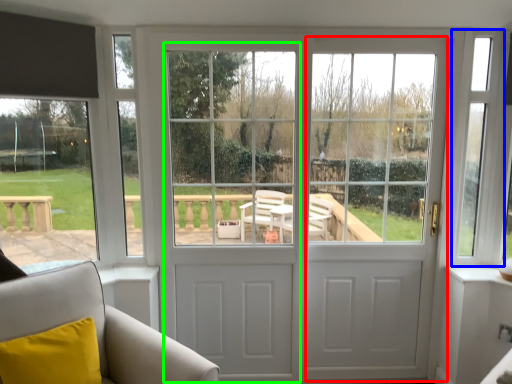
Question: Which object is positioned farthest from screen door (highlighted by a red box)? Select from window screen (highlighted by a blue box) and screen door (highlighted by a green box).

Choices:
 (A) window screen
 (B) screen door

Answer: (B)